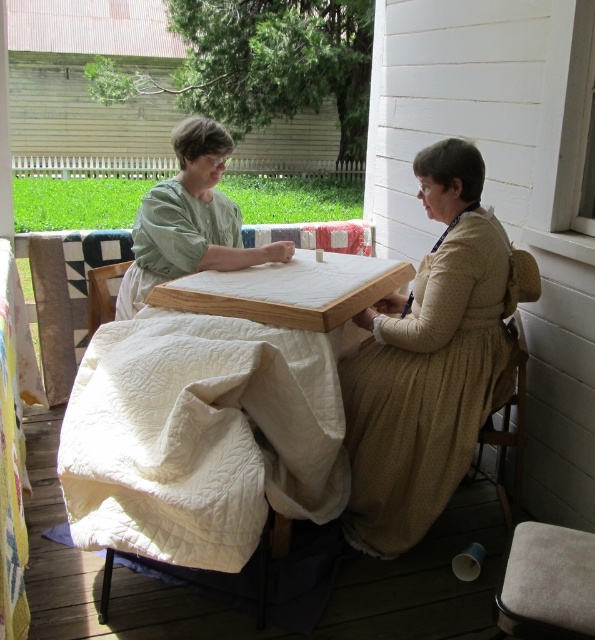
In the scene shown: Which is above, white quilted cloth at center or white quilted fabric at left?

Positioned higher is white quilted fabric at left.

At what (x,y) coordinates should I click in order to perform the action: click on white quilted cloth at center. Please return your answer as a coordinate pair (x, y). Looking at the image, I should click on (201, 436).

Looking at this image, who is more forward, (358, 477) or (208, 248)?

Positioned in front is point (358, 477).

Looking at this image, does light brown cotton dress at center appear on the right side of green matte fabric at center?

Yes, light brown cotton dress at center is to the right of green matte fabric at center.

You are a GUI agent. You are given a task and a screenshot of the screen. Output one action in this format:
    pyautogui.click(x=<x>, y=<y>)
    Task: Click on the light brown cotton dress at center
    This screenshot has height=640, width=595.
    Given the screenshot: What is the action you would take?
    click(x=427, y=364)

This screenshot has height=640, width=595. I want to click on light brown cotton dress at center, so (427, 364).

Is white quilted cloth at center positioned behind light brown cotton dress at center?

That is False.

Does white quilted cloth at center have a greater height compared to light brown cotton dress at center?

Incorrect, white quilted cloth at center's height is not larger of light brown cotton dress at center's.

Find the location of a particular element. Image resolution: width=595 pixels, height=640 pixels. white quilted cloth at center is located at coordinates (201, 436).

The image size is (595, 640). Identify the location of white quilted cloth at center. (201, 436).